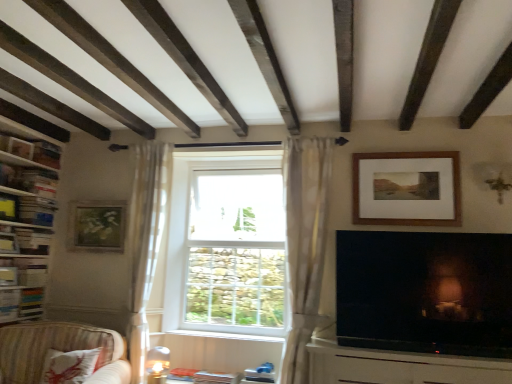
You are a GUI agent. You are given a task and a screenshot of the screen. Output one action in this format:
    pyautogui.click(x=<x>, y=<y>)
    Task: Click on the free point above matte gold picture frame at left, which is counted as the 2th picture frame, starting from the front (from a real-world perspective)
    The height and width of the screenshot is (384, 512).
    Given the screenshot: What is the action you would take?
    pyautogui.click(x=99, y=200)